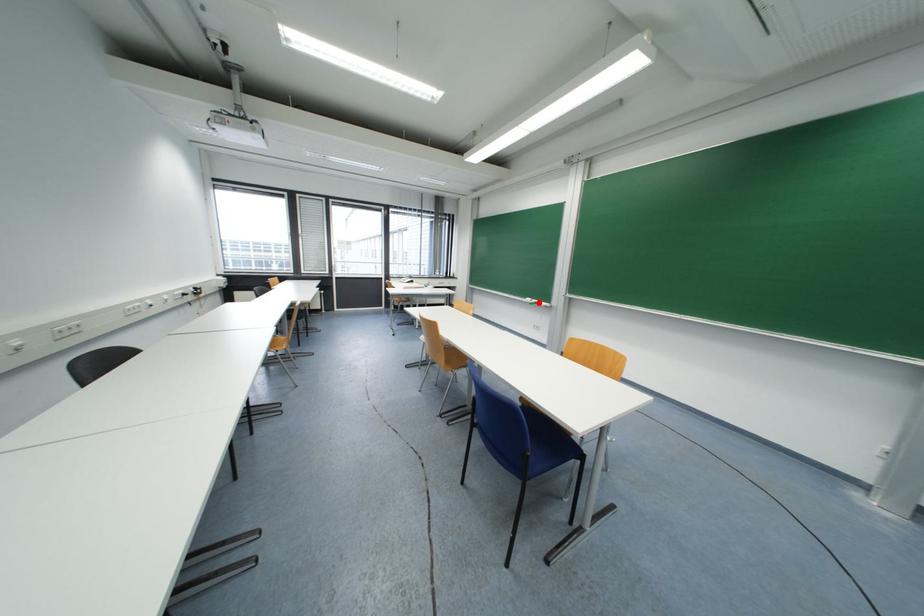
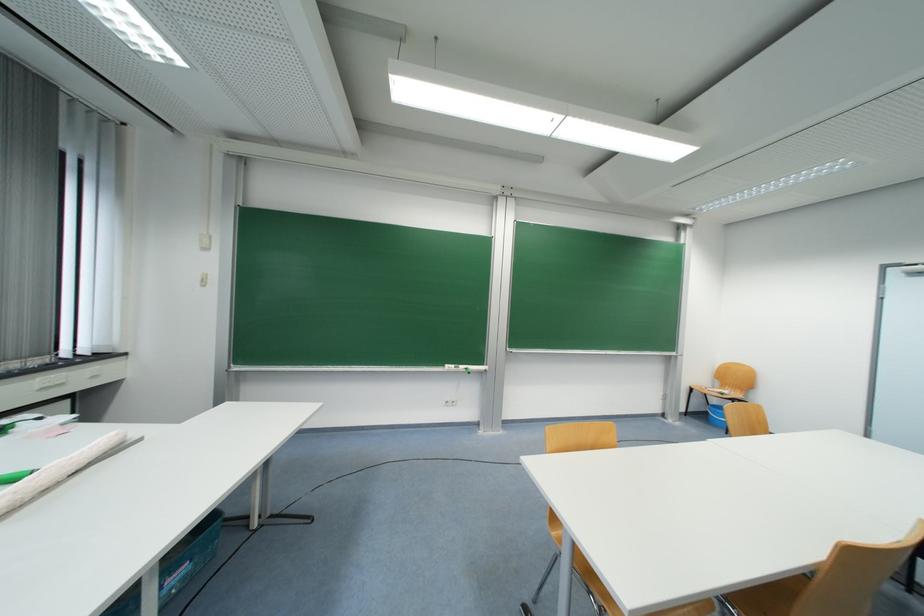
The point at the highlighted location is marked in the first image. Where is the corresponding point in the second image?

(467, 369)